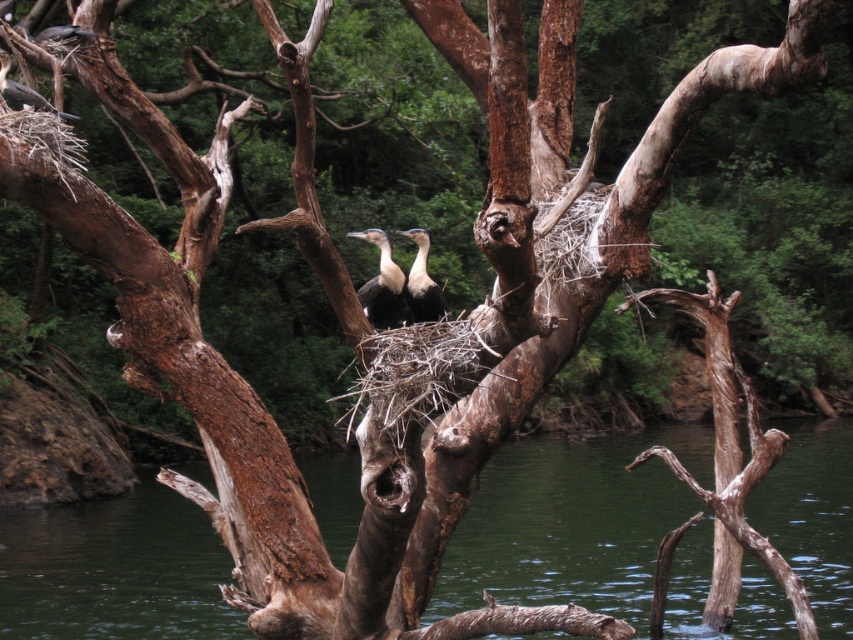
Describe the element at coordinates (570, 524) in the screenshot. This screenshot has width=853, height=640. I see `green liquid water at lower center` at that location.

Who is more distant from viewer, (834, 428) or (3, 65)?

The point (834, 428) is behind.

The width and height of the screenshot is (853, 640). What are the coordinates of `green liquid water at lower center` in the screenshot? It's located at (570, 524).

Locate an element on the screen. white glossy bird at center is located at coordinates (380, 282).

Can you confirm if white glossy bird at center is taller than matte black bird at upper left?

No.

Where is `white glossy bird at center`? This screenshot has width=853, height=640. white glossy bird at center is located at coordinates (380, 282).

Is green liquid water at lower center below white glossy birds at center?

Indeed, green liquid water at lower center is positioned under white glossy birds at center.

Between green liquid water at lower center and white glossy birds at center, which one is positioned lower?

green liquid water at lower center

Describe the element at coordinates (570, 524) in the screenshot. I see `green liquid water at lower center` at that location.

The height and width of the screenshot is (640, 853). In order to click on green liquid water at lower center in this screenshot , I will do `click(570, 524)`.